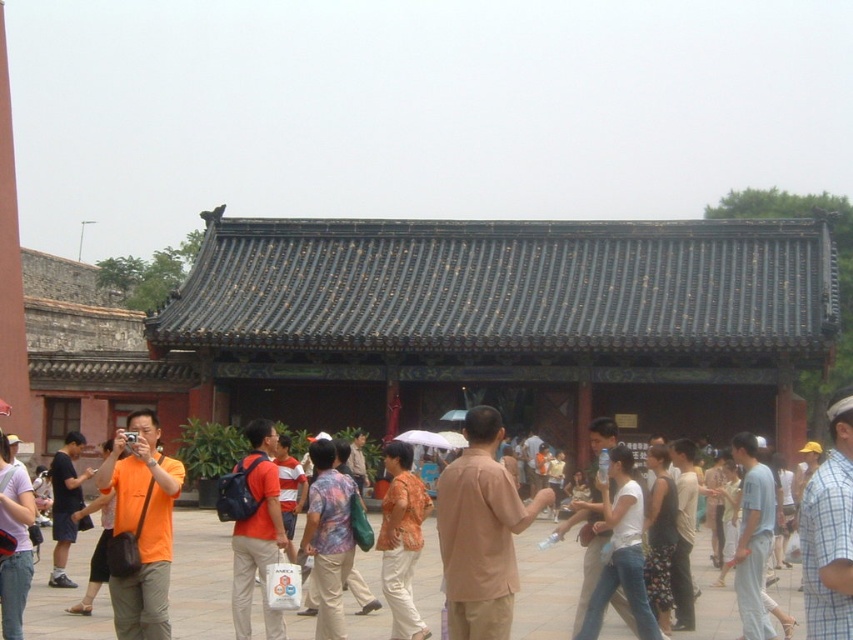
Which is in front, point (158, 584) or point (277, 531)?

Positioned in front is point (158, 584).

Is orange cotton shirt at center further to the viewer compared to orange fabric backpack at center?

No, orange cotton shirt at center is in front of orange fabric backpack at center.

Measure the distance between point (144, 464) and camera.

31.72 meters

You are a GUI agent. You are given a task and a screenshot of the screen. Output one action in this format:
    pyautogui.click(x=<x>, y=<y>)
    Task: Click on the orange cotton shirt at center
    The image size is (853, 640).
    Given the screenshot: What is the action you would take?
    pyautogui.click(x=141, y=524)

Is point (328, 561) positioned in front of point (666, 620)?

Yes, point (328, 561) is closer to viewer.

Is point (318, 586) positioned behind point (654, 605)?

No, it is in front of (654, 605).

Image resolution: width=853 pixels, height=640 pixels. What are the coordinates of `printed cotton shirt at center` in the screenshot? It's located at (328, 538).

Does printed cotton shirt at center lie behind orange fabric shirt at center?

No, printed cotton shirt at center is in front of orange fabric shirt at center.

Who is positioned more to the left, printed cotton shirt at center or orange fabric shirt at center?

Positioned to the left is printed cotton shirt at center.

Is point (332, 563) positioned in front of point (410, 588)?

Yes, it is.

Locate an element on the screen. printed cotton shirt at center is located at coordinates (328, 538).